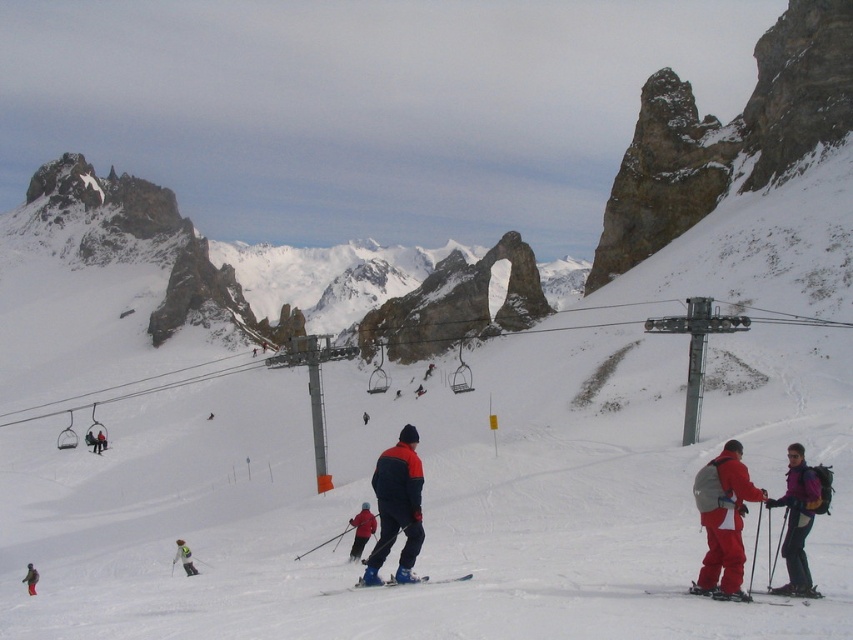
Is point (749, 595) positioned behind point (103, 438)?

No, (749, 595) is in front of (103, 438).

Between point (761, 602) and point (102, 436), which one is positioned behind?

Point (102, 436)

What are the coordinates of `matte black ski at lower right` in the screenshot? It's located at (764, 600).

Does red ski jacket at center have a lesser height compared to matte black jacket at left?

In fact, red ski jacket at center may be taller than matte black jacket at left.

The height and width of the screenshot is (640, 853). What do you see at coordinates (361, 531) in the screenshot?
I see `red ski jacket at center` at bounding box center [361, 531].

Locate an element on the screen. The height and width of the screenshot is (640, 853). red ski jacket at center is located at coordinates (361, 531).

Does point (811, 518) lie in front of point (25, 577)?

Yes, it is.

Does pink fabric jacket at lower right have a greater width compared to red ski suit at lower left?

In fact, pink fabric jacket at lower right might be narrower than red ski suit at lower left.

You are a GUI agent. You are given a task and a screenshot of the screen. Output one action in this format:
    pyautogui.click(x=<x>, y=<y>)
    Task: Click on the pink fabric jacket at lower right
    
    Given the screenshot: What is the action you would take?
    [x=798, y=522]